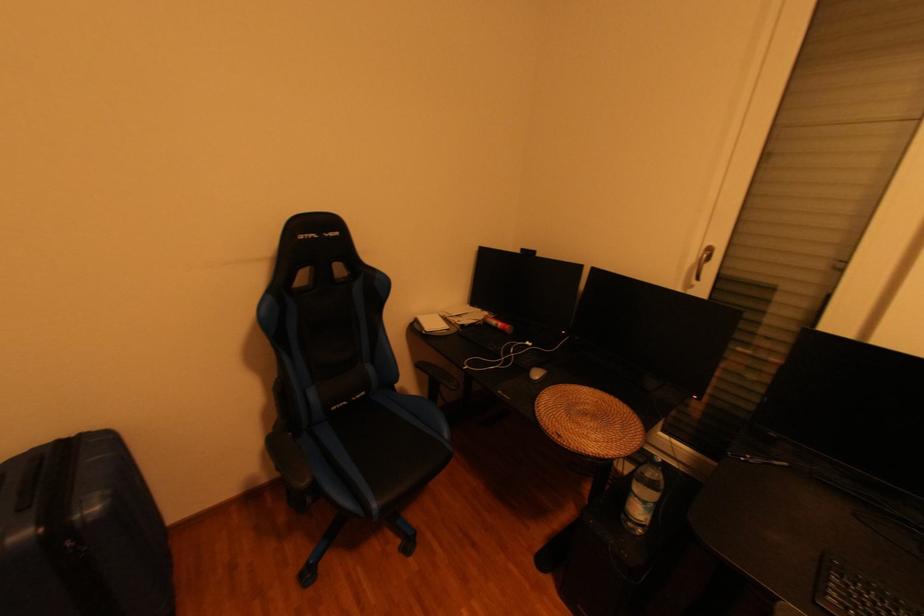
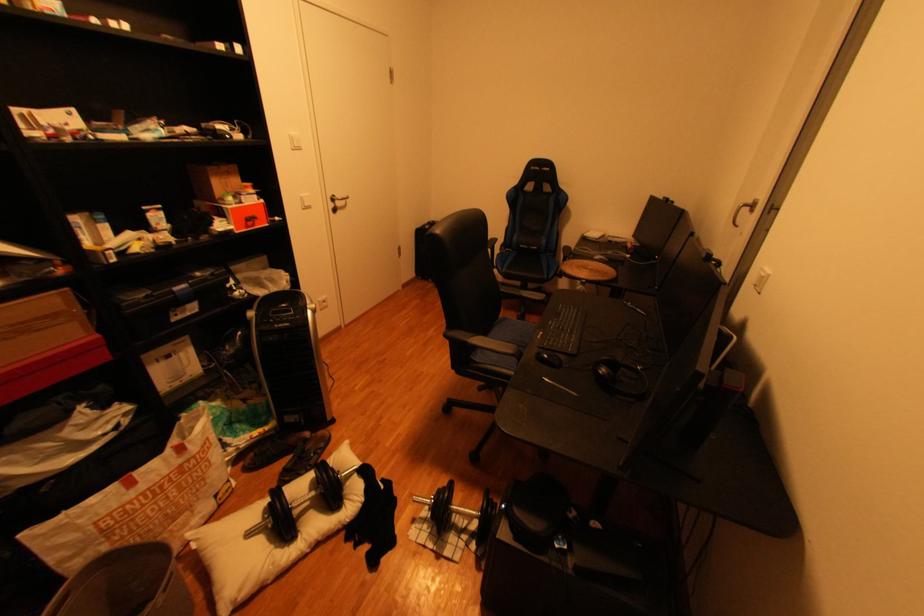
Locate, in the second image, the point that corresponds to point (344, 408) in the first image.

(531, 246)